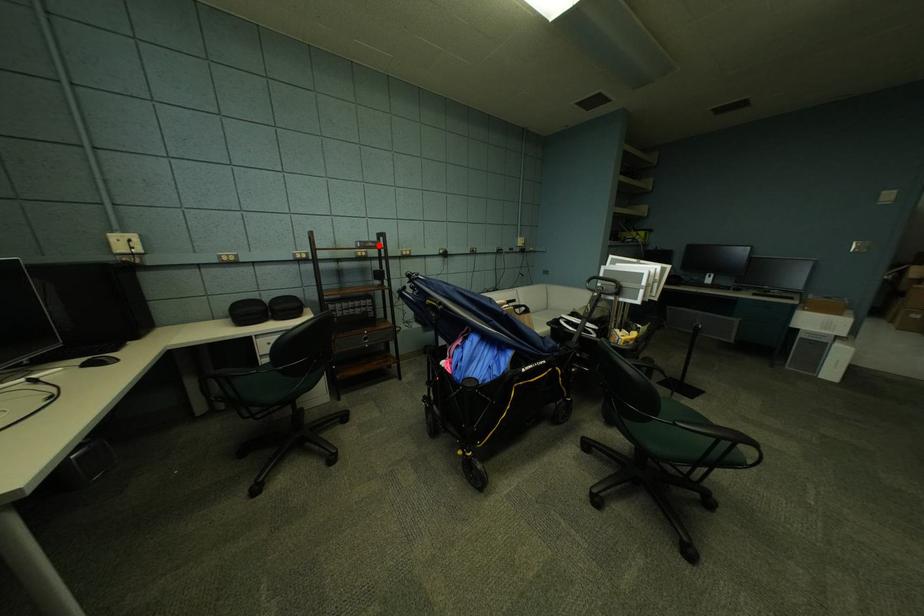
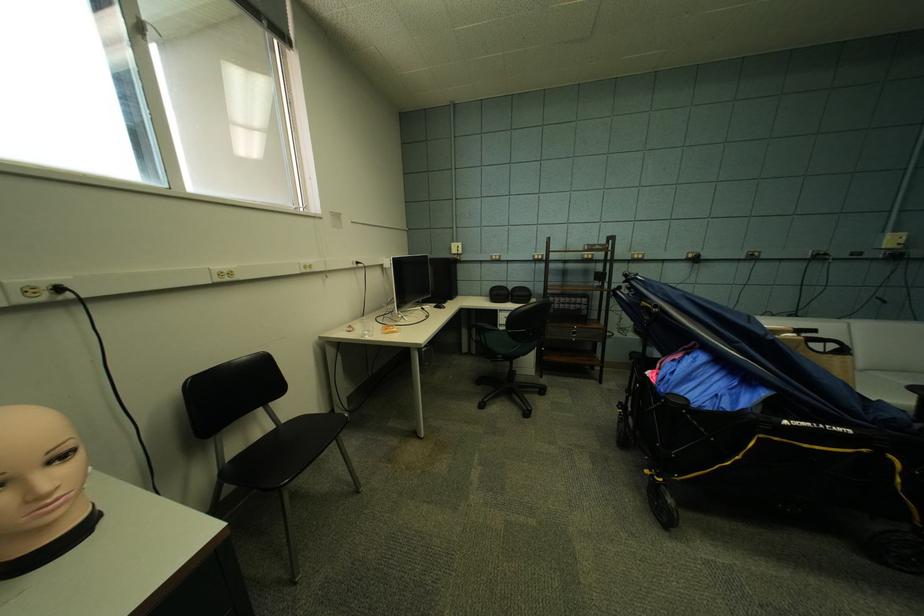
Where in the second image is the point corresponding to the highlighted location from the first image?

(606, 248)